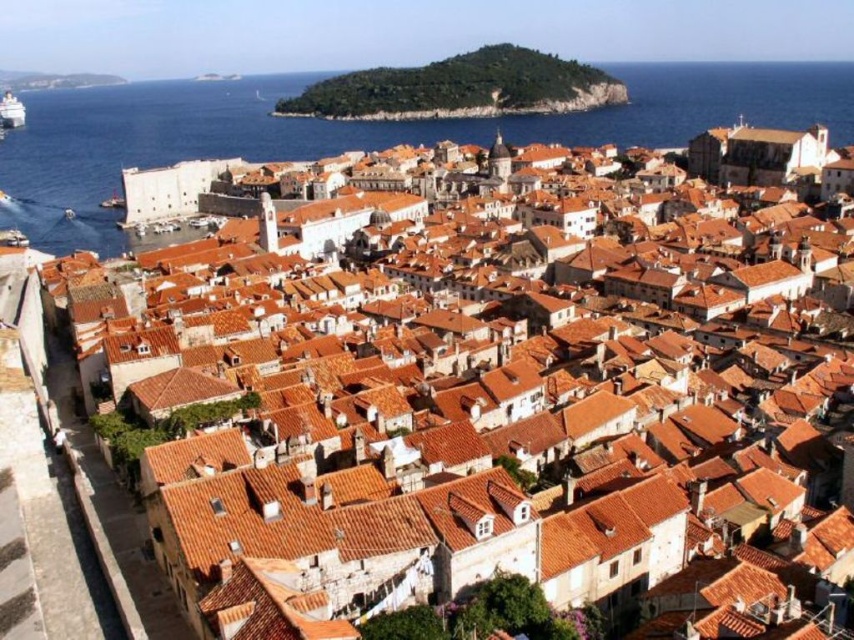
Question: Which point appears farthest from the camera in this image?

Choices:
 (A) (542, 96)
 (B) (115, 225)

Answer: (A)

Question: Is blue water at lower left closer to camera compared to green leafy hillside at upper center?

Choices:
 (A) yes
 (B) no

Answer: (A)

Question: Estimate the real-world distances between objects in this image. Which object is farther from the white plastic boat at upper left?

Choices:
 (A) blue water at lower left
 (B) green leafy hillside at upper center

Answer: (B)

Question: Does blue water at lower left have a larger size compared to white plastic boat at upper left?

Choices:
 (A) no
 (B) yes

Answer: (B)

Question: Does green leafy hillside at upper center come behind white plastic boat at upper left?

Choices:
 (A) yes
 (B) no

Answer: (B)

Question: Among these points, which one is farthest from the camera?

Choices:
 (A) (24, 109)
 (B) (592, 122)
 (C) (588, 84)

Answer: (A)